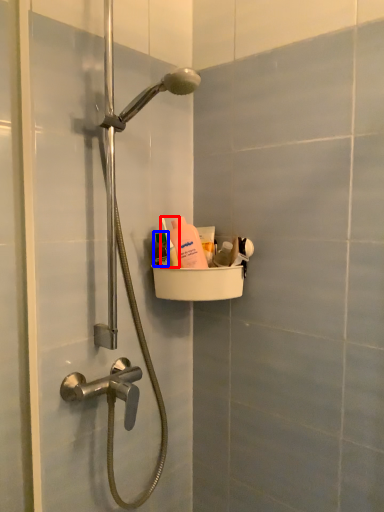
Question: Among these objects, which one is nearest to the camera, toiletry (highlighted by a red box) or mouthwash (highlighted by a blue box)?

Choices:
 (A) toiletry
 (B) mouthwash

Answer: (A)